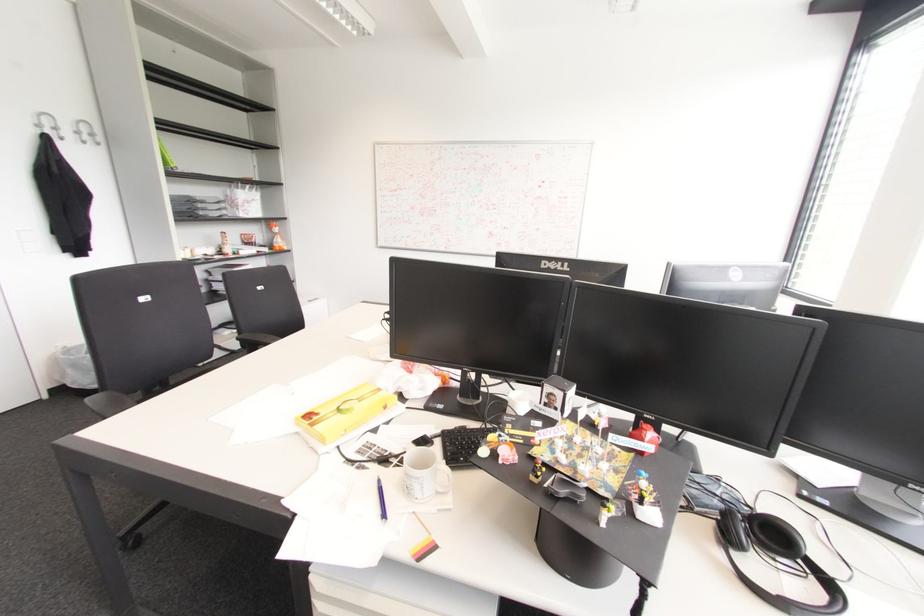
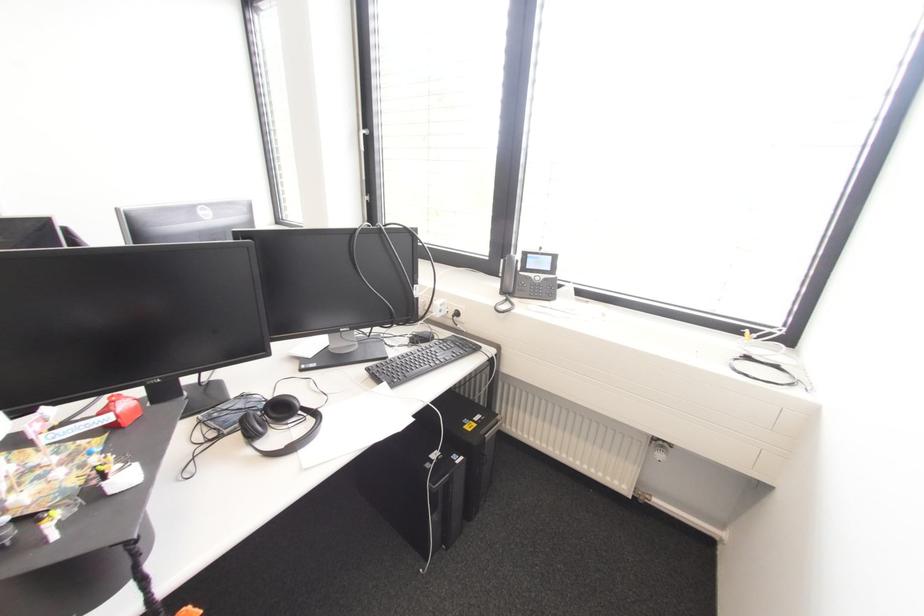
Locate, in the second image, the point that corresponds to point 773,535 in the first image.

(281, 408)